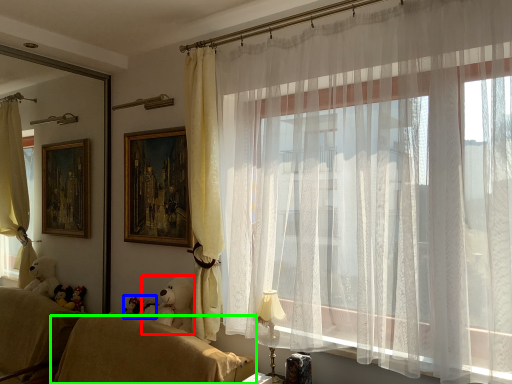
Question: Estimate the real-world distances between objects in this image. Which object is closer to animal (highlighted by a red box), toy (highlighted by a blue box) or furniture (highlighted by a green box)?

Choices:
 (A) toy
 (B) furniture

Answer: (A)